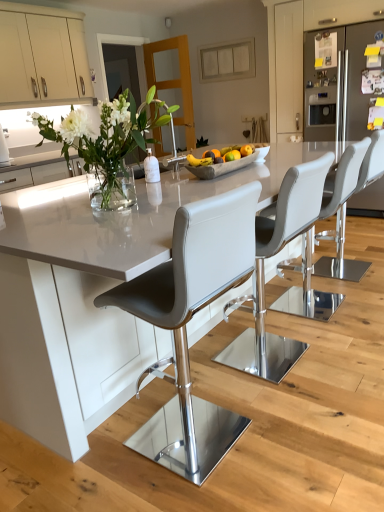
Locate an element on the screen. Image resolution: width=384 pixels, height=512 pixels. vacant space to the right of white leather bar stool at center, which ranks as the 3th chair in back-to-front order is located at coordinates (342, 349).